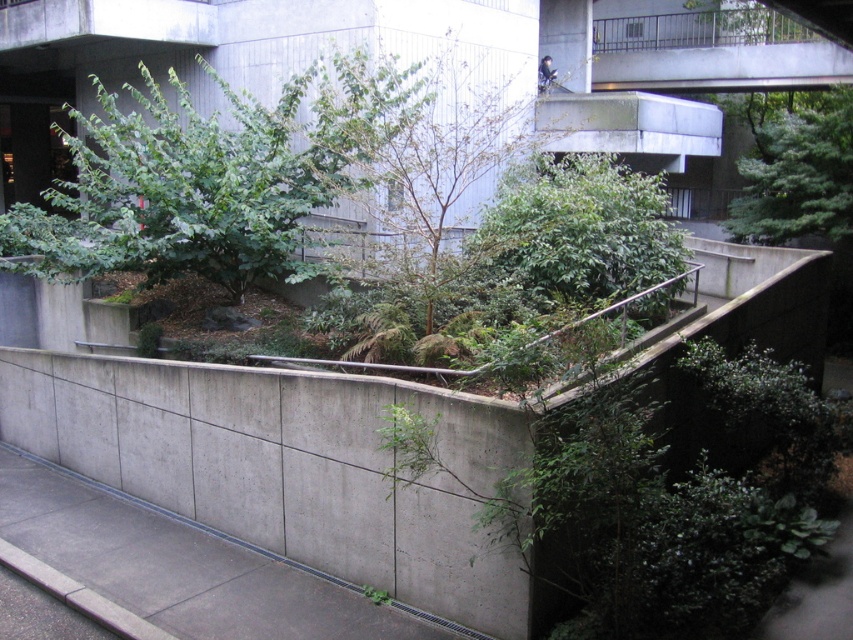
Question: Based on their relative distances, which object is nearer to the green textured tree at upper right?

Choices:
 (A) concrete railing at upper right
 (B) concrete at center
 (C) green leafy tree at upper left
 (D) green leafy bush at center

Answer: (A)

Question: Is green leafy tree at upper left to the right of concrete railing at upper right from the viewer's perspective?

Choices:
 (A) yes
 (B) no

Answer: (B)

Question: Which of the following is the farthest from the observer?

Choices:
 (A) (843, 230)
 (B) (778, 296)
 (C) (784, 38)
 (D) (431, 188)

Answer: (C)

Question: Does concrete railing at upper right appear under green textured tree at upper right?

Choices:
 (A) no
 (B) yes

Answer: (A)

Question: Based on their relative distances, which object is nearer to the green leafy bush at center?

Choices:
 (A) green leafy tree at upper left
 (B) concrete railing at upper right
 (C) green textured tree at upper right

Answer: (A)

Question: Is concrete at center positioned in front of concrete railing at upper right?

Choices:
 (A) no
 (B) yes

Answer: (B)